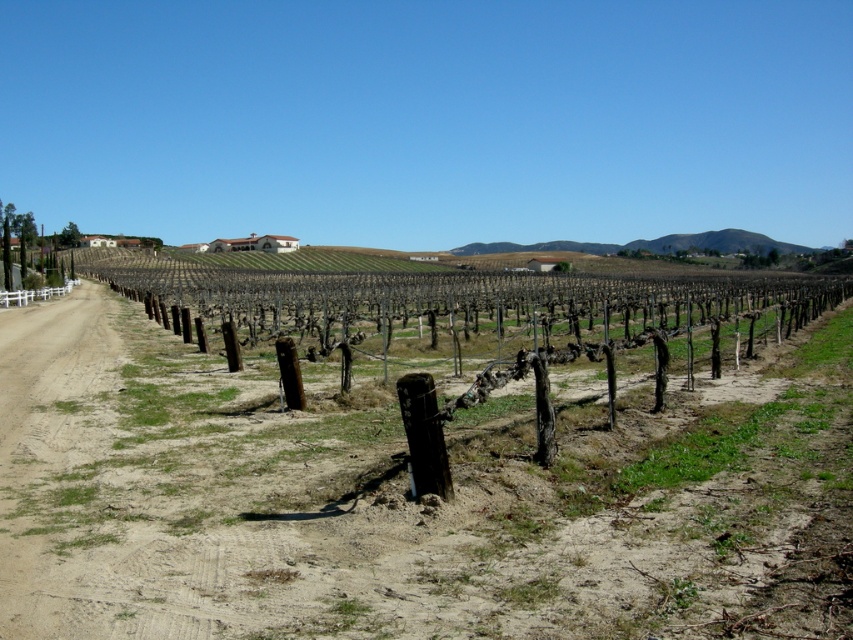
You are a farmer standing at the edge of the vineyard and looking towards the center. You see the brown dirt field at center and the brown wooden fence at center. Which object is closer to you?

The brown dirt field at center is positioned under the brown wooden fence at center, so the fence is closer to you.

Based on the photo, you are a farmer who wants to plant new grapevines in the brown dirt field at center. However, you also need to ensure that the brown wooden fence at center remains intact. Based on the scene, which area is more suitable for planting the grapevines without disturbing the fence?

The brown dirt field at center has a smaller size compared to the brown wooden fence at center, so planting grapevines in the brown dirt field at center would be more suitable as it is smaller and less likely to interfere with the larger brown wooden fence at center.